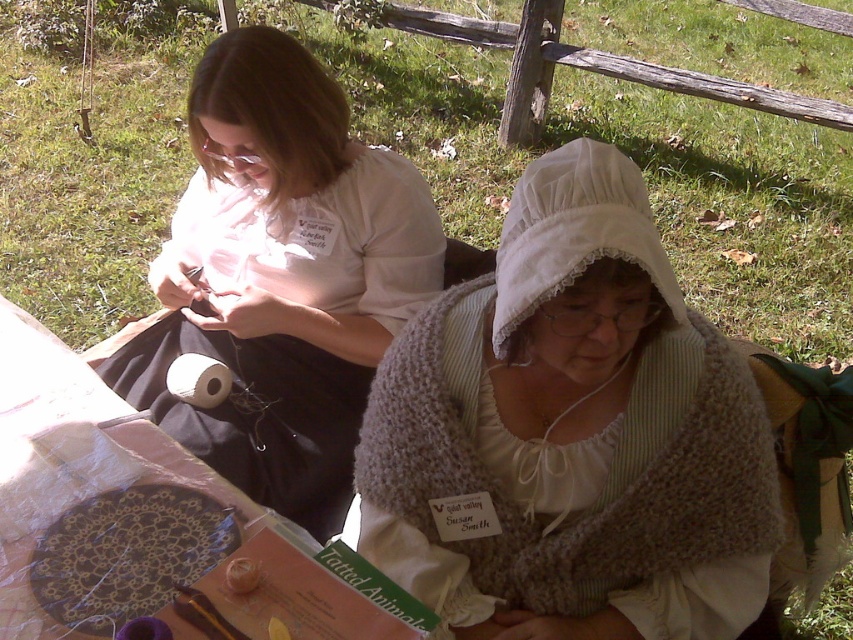
Can you confirm if white knit shawl at center is wider than matte white shirt at upper left?

No, white knit shawl at center is not wider than matte white shirt at upper left.

Is white knit shawl at center positioned in front of matte white shirt at upper left?

Yes.

This screenshot has width=853, height=640. I want to click on white knit shawl at center, so click(572, 435).